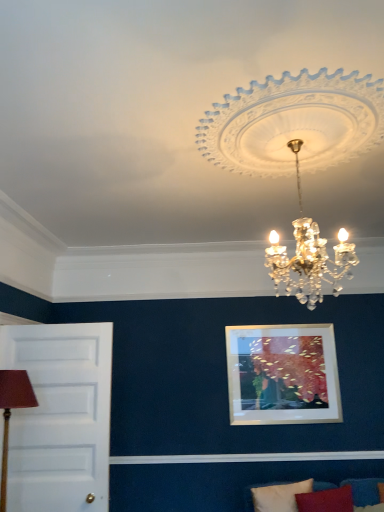
Question: Is the surface of brown fabric lampshade at left in direct contact with white crystal chandelier at upper center?

Choices:
 (A) yes
 (B) no

Answer: (B)

Question: Does brown fabric lampshade at left appear on the right side of white crystal chandelier at upper center?

Choices:
 (A) no
 (B) yes

Answer: (A)

Question: Could white crystal chandelier at upper center be considered to be inside brown fabric lampshade at left?

Choices:
 (A) no
 (B) yes

Answer: (A)

Question: Is brown fabric lampshade at left oriented towards white crystal chandelier at upper center?

Choices:
 (A) yes
 (B) no

Answer: (B)

Question: Does brown fabric lampshade at left come in front of white crystal chandelier at upper center?

Choices:
 (A) no
 (B) yes

Answer: (A)

Question: Can you confirm if brown fabric lampshade at left is thinner than white crystal chandelier at upper center?

Choices:
 (A) yes
 (B) no

Answer: (A)

Question: Can you confirm if velvet blue couch at lower right is wider than white painted wood door at left?

Choices:
 (A) no
 (B) yes

Answer: (B)

Question: From a real-world perspective, is velvet blue couch at lower right beneath white painted wood door at left?

Choices:
 (A) no
 (B) yes

Answer: (B)

Question: Can you confirm if velvet blue couch at lower right is taller than white painted wood door at left?

Choices:
 (A) yes
 (B) no

Answer: (B)

Question: Would you consider velvet blue couch at lower right to be distant from white painted wood door at left?

Choices:
 (A) yes
 (B) no

Answer: (A)

Question: Considering the relative sizes of velvet blue couch at lower right and white painted wood door at left in the image provided, is velvet blue couch at lower right bigger than white painted wood door at left?

Choices:
 (A) no
 (B) yes

Answer: (A)

Question: Is velvet blue couch at lower right with white painted wood door at left?

Choices:
 (A) no
 (B) yes

Answer: (A)

Question: Can you confirm if white crystal chandelier at upper center is positioned to the left of white fabric pillow at lower right?

Choices:
 (A) no
 (B) yes

Answer: (B)